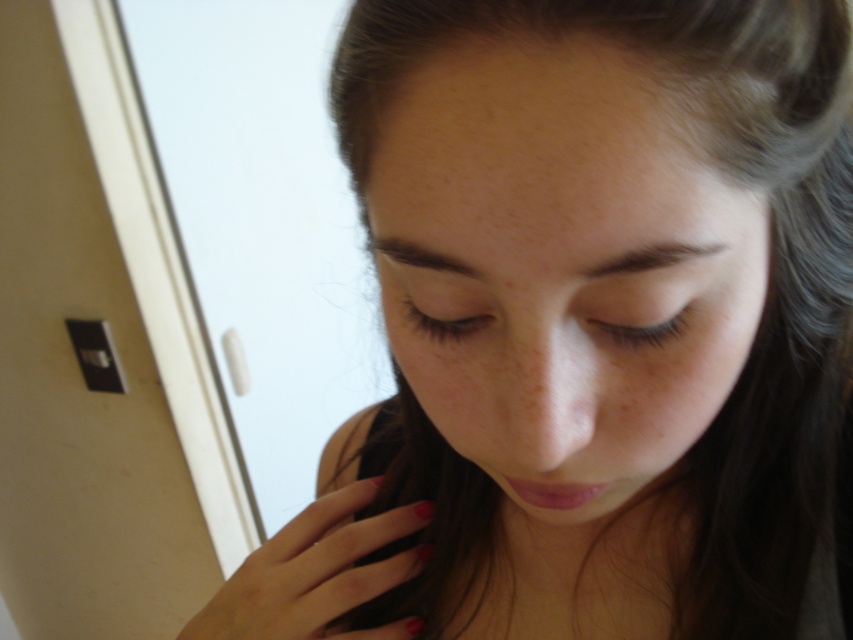
Question: Does smooth skin face at center have a lesser width compared to polished red nails at lower center?

Choices:
 (A) yes
 (B) no

Answer: (A)

Question: Is smooth skin face at center positioned before polished red nails at lower center?

Choices:
 (A) no
 (B) yes

Answer: (B)

Question: Among these objects, which one is farthest from the camera?

Choices:
 (A) smooth skin face at center
 (B) polished red nails at lower center

Answer: (B)

Question: Can you confirm if smooth skin face at center is wider than polished red nails at lower center?

Choices:
 (A) yes
 (B) no

Answer: (B)